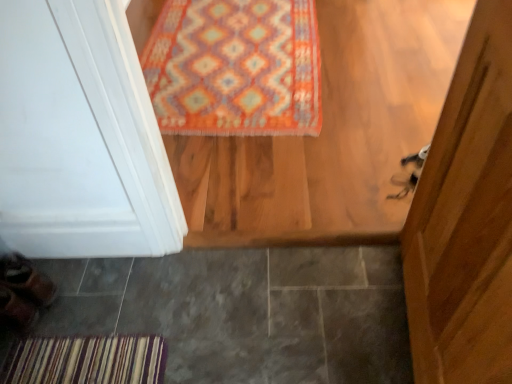
The image size is (512, 384). I want to click on empty space that is to the right of brown leather shoe at lower left, which is the first shoe from top to bottom, so click(75, 289).